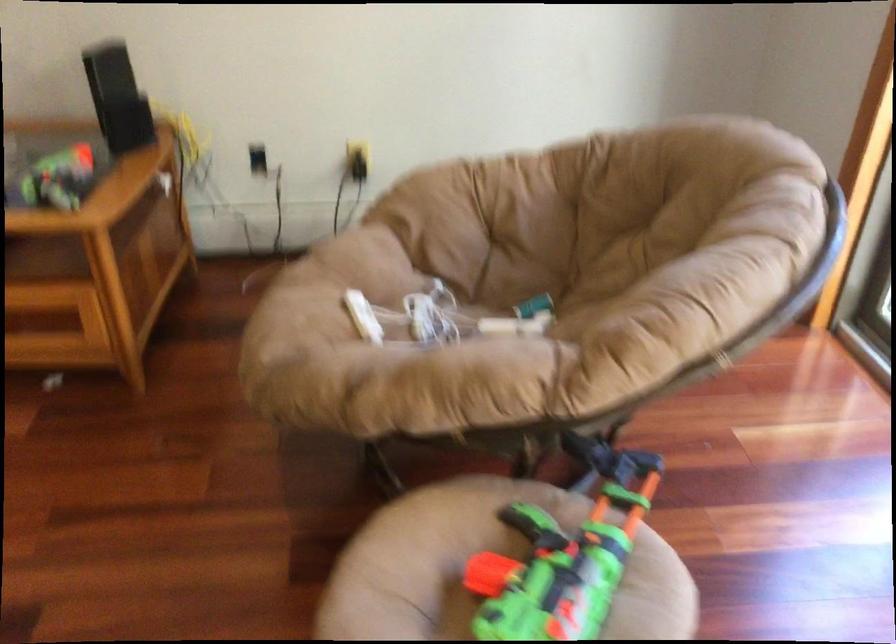
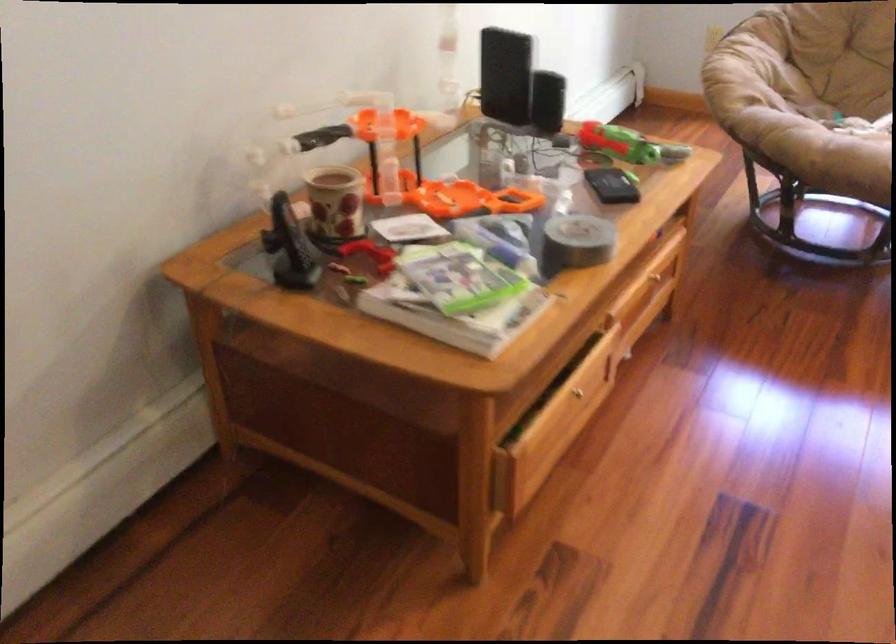
In the second image, find the point that corresponds to point (448, 193) in the first image.

(745, 69)